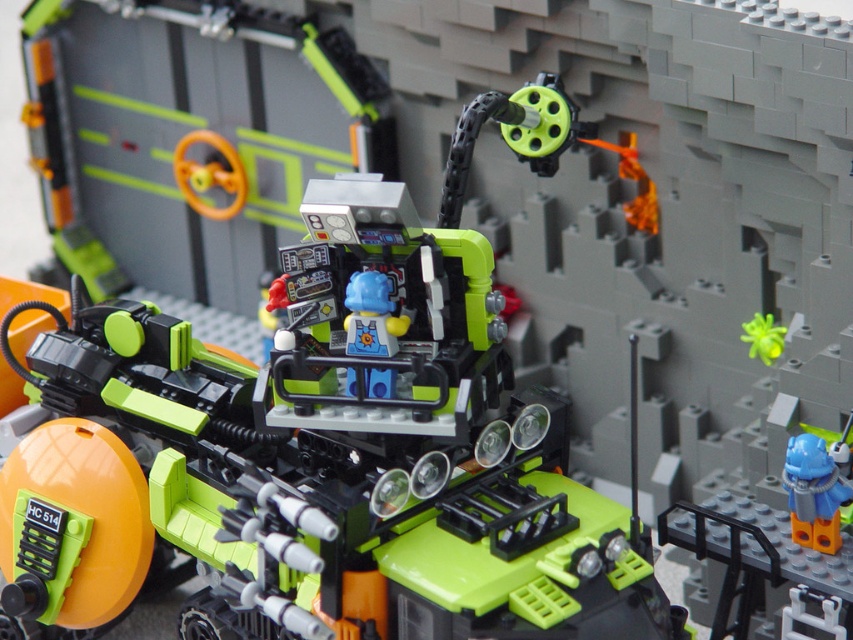
Which is behind, point (123, 392) or point (805, 484)?

Positioned behind is point (123, 392).

Between point (550, 77) and point (820, 522), which one is positioned in front?

Positioned in front is point (820, 522).

The image size is (853, 640). I want to click on green matte vehicle at center, so click(323, 448).